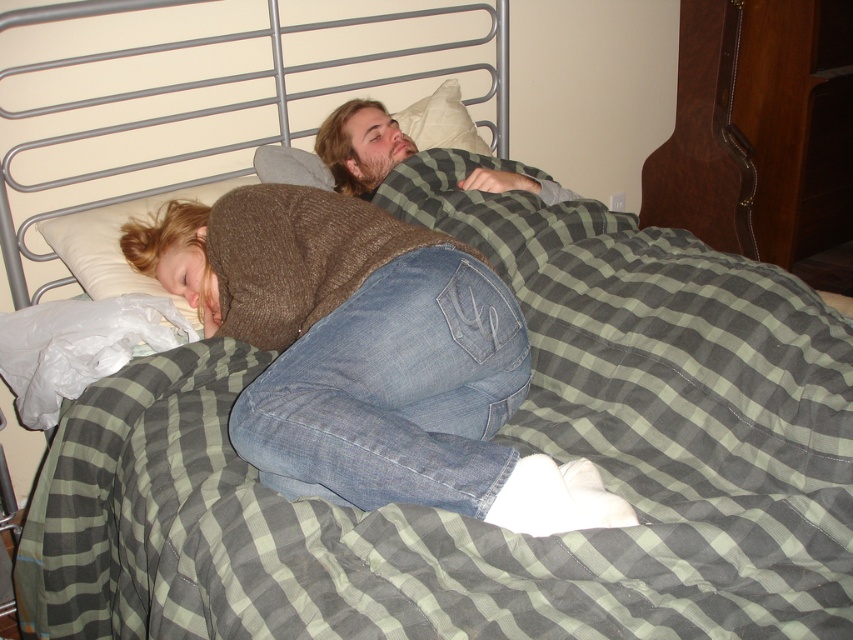
Question: Is brown knitted sweater at center positioned in front of metallic silver headboard at upper center?

Choices:
 (A) no
 (B) yes

Answer: (B)

Question: Which object appears farthest from the camera in this image?

Choices:
 (A) bearded man at center
 (B) white soft pillow at upper center
 (C) brown knitted sweater at center
 (D) metallic silver headboard at upper center

Answer: (B)

Question: From the image, what is the correct spatial relationship of brown knitted sweater at center in relation to bearded man at center?

Choices:
 (A) above
 (B) below

Answer: (B)

Question: Which object is positioned farthest from the bearded man at center?

Choices:
 (A) metallic silver headboard at upper center
 (B) brown knitted sweater at center
 (C) white soft pillow at upper center

Answer: (B)

Question: Does metallic silver headboard at upper center have a larger size compared to bearded man at center?

Choices:
 (A) yes
 (B) no

Answer: (A)

Question: Among these points, which one is nearest to the camera?

Choices:
 (A) (402, 113)
 (B) (148, 88)

Answer: (B)